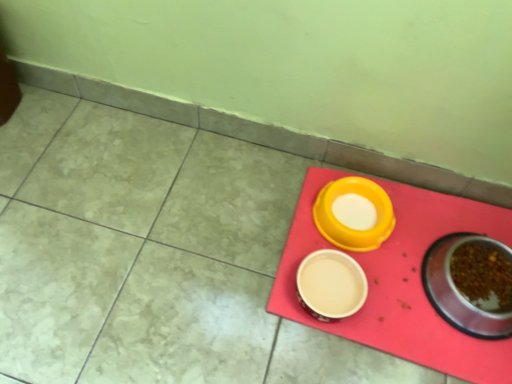
Locate an element on the screen. vacant space underneath rubberized red tray at lower right (from a real-world perspective) is located at coordinates (403, 269).